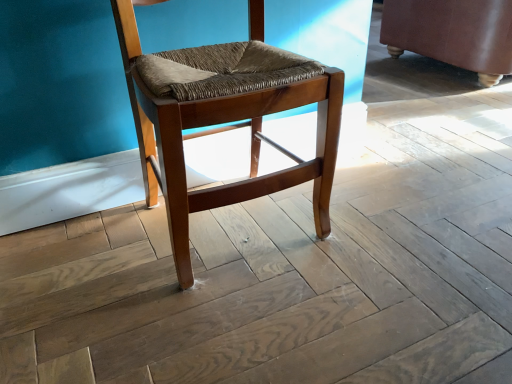
Question: Considering the relative positions of wooden woven seat at center and brown leather swivel chair at right in the image provided, is wooden woven seat at center in front of brown leather swivel chair at right?

Choices:
 (A) no
 (B) yes

Answer: (B)

Question: Does wooden woven seat at center have a smaller size compared to brown leather swivel chair at right?

Choices:
 (A) no
 (B) yes

Answer: (B)

Question: Would you say wooden woven seat at center is outside brown leather swivel chair at right?

Choices:
 (A) yes
 (B) no

Answer: (A)

Question: Can you confirm if wooden woven seat at center is positioned to the right of brown leather swivel chair at right?

Choices:
 (A) no
 (B) yes

Answer: (A)

Question: Considering the relative sizes of wooden woven seat at center and brown leather swivel chair at right in the image provided, is wooden woven seat at center taller than brown leather swivel chair at right?

Choices:
 (A) no
 (B) yes

Answer: (B)

Question: Is wooden woven seat at center thinner than brown leather swivel chair at right?

Choices:
 (A) no
 (B) yes

Answer: (B)

Question: Can you confirm if brown leather swivel chair at right is wider than wooden woven seat at center?

Choices:
 (A) yes
 (B) no

Answer: (A)

Question: Does brown leather swivel chair at right have a lesser width compared to wooden woven seat at center?

Choices:
 (A) yes
 (B) no

Answer: (B)

Question: Is brown leather swivel chair at right not close to wooden woven seat at center?

Choices:
 (A) yes
 (B) no

Answer: (A)

Question: Is brown leather swivel chair at right smaller than wooden woven seat at center?

Choices:
 (A) yes
 (B) no

Answer: (B)

Question: Does brown leather swivel chair at right turn towards wooden woven seat at center?

Choices:
 (A) no
 (B) yes

Answer: (A)

Question: From the image's perspective, is brown leather swivel chair at right located beneath wooden woven seat at center?

Choices:
 (A) yes
 (B) no

Answer: (B)

Question: In terms of height, does wooden woven seat at center look taller or shorter compared to brown leather swivel chair at right?

Choices:
 (A) tall
 (B) short

Answer: (A)